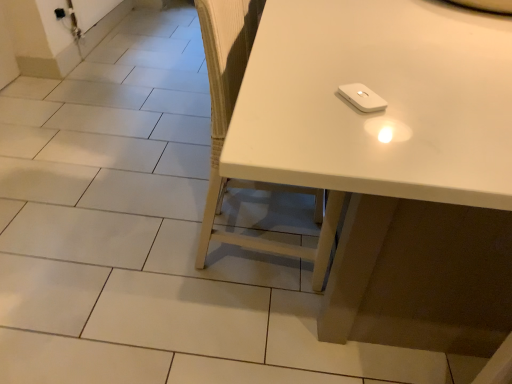
Find the location of a particular element. The width and height of the screenshot is (512, 384). free space to the left of white matte wii controller at upper center is located at coordinates (289, 99).